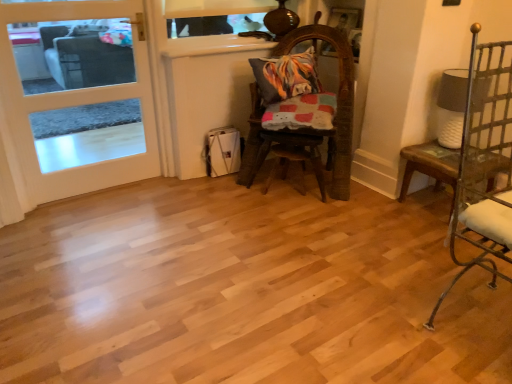
The width and height of the screenshot is (512, 384). Describe the element at coordinates (430, 165) in the screenshot. I see `white ceramic table at right` at that location.

What is the approximate height of worn wood chair at center, marked as the 1th chair in a back-to-front arrangement?

It is 3.36 feet.

Identify the location of white textured lampshade at right. pos(451,107).

At what (x,y) coordinates should I click in order to perform the action: click on white ceramic table at right. Please return your answer as a coordinate pair (x, y). The height and width of the screenshot is (384, 512). Looking at the image, I should click on (430, 165).

Based on the photo, which is in front, multicolored fabric pillow at center or white ceramic table at right?

Positioned in front is white ceramic table at right.

From the image's perspective, is multicolored fabric pillow at center above or below white ceramic table at right?

multicolored fabric pillow at center is above white ceramic table at right.

In the scene shown: Does multicolored fabric pillow at center appear on the left side of white ceramic table at right?

Yes, multicolored fabric pillow at center is to the left of white ceramic table at right.

From a real-world perspective, is white textured lampshade at right above or below white ceramic table at right?

From a real-world perspective, white textured lampshade at right is physically above white ceramic table at right.

In terms of size, does white textured lampshade at right appear bigger or smaller than white ceramic table at right?

Considering their sizes, white textured lampshade at right takes up less space than white ceramic table at right.

Are white textured lampshade at right and white ceramic table at right beside each other?

There is a gap between white textured lampshade at right and white ceramic table at right.

There is a white ceramic table at right. At what (x,y) coordinates should I click in order to perform the action: click on lamp above it (from a real-world perspective). Please return your answer as a coordinate pair (x, y). The width and height of the screenshot is (512, 384). Looking at the image, I should click on (451, 107).

From the picture: In terms of width, does white ceramic table at right look wider or thinner when compared to white wood door at left?

white ceramic table at right is wider than white wood door at left.

Which is correct: white ceramic table at right is inside white wood door at left, or outside of it?

white ceramic table at right exists outside the volume of white wood door at left.

Is white ceramic table at right looking in the opposite direction of white wood door at left?

No.

What's the angular difference between white ceramic table at right and white wood door at left's facing directions?

The angle between the facing direction of white ceramic table at right and the facing direction of white wood door at left is 0.615 degrees.

Is white textured lampshade at right inside the boundaries of white wood door at left, or outside?

white textured lampshade at right is spatially situated outside white wood door at left.

Can you confirm if white textured lampshade at right is smaller than white wood door at left?

Yes, white textured lampshade at right is smaller than white wood door at left.

From the image's perspective, would you say white textured lampshade at right is shown under white wood door at left?

Indeed, from the image's perspective, white textured lampshade at right is shown beneath white wood door at left.

Considering the positions of points (444, 72) and (16, 108), is point (444, 72) farther from camera compared to point (16, 108)?

Yes.

From a real-world perspective, does metallic silver chair at right, the 1th chair from the front, sit lower than white wood door at left?

Correct, in the physical world, metallic silver chair at right, the 1th chair from the front, is lower than white wood door at left.

Is metallic silver chair at right, positioned as the 2th chair in back-to-front order, far from white wood door at left?

Yes.

Can you tell me how much metallic silver chair at right, positioned as the first chair in right-to-left order, and white wood door at left differ in facing direction?

They differ by 93.7 degrees in their facing directions.

Measure the distance from metallic silver chair at right, the 2th chair viewed from the left, to white wood door at left.

They are 1.89 meters apart.

Considering the relative sizes of white ceramic table at right and white textured lampshade at right in the image provided, is white ceramic table at right wider than white textured lampshade at right?

Indeed, white ceramic table at right has a greater width compared to white textured lampshade at right.

Considering the relative sizes of white ceramic table at right and white textured lampshade at right in the image provided, is white ceramic table at right smaller than white textured lampshade at right?

No, white ceramic table at right is not smaller than white textured lampshade at right.

Consider the image. Visually, is white ceramic table at right positioned to the left or to the right of white textured lampshade at right?

Based on their positions, white ceramic table at right is located to the left of white textured lampshade at right.

Is white ceramic table at right aimed at white textured lampshade at right?

No, white ceramic table at right is not turned towards white textured lampshade at right.

Measure the distance between worn wood chair at center, arranged as the first chair when viewed from the left, and metallic silver chair at right, the 1th chair from the front.

worn wood chair at center, arranged as the first chair when viewed from the left, is 35.99 inches from metallic silver chair at right, the 1th chair from the front.

Who is bigger, worn wood chair at center, the second chair in the front-to-back sequence, or metallic silver chair at right, positioned as the 2th chair in back-to-front order?

worn wood chair at center, the second chair in the front-to-back sequence, is bigger.

Can you tell me how much worn wood chair at center, the second chair in the front-to-back sequence, and metallic silver chair at right, positioned as the first chair in right-to-left order, differ in facing direction?

The facing directions of worn wood chair at center, the second chair in the front-to-back sequence, and metallic silver chair at right, positioned as the first chair in right-to-left order, are 84.8 degrees apart.

Is worn wood chair at center, which is the second chair from right to left, oriented towards metallic silver chair at right, positioned as the first chair in right-to-left order?

Yes, worn wood chair at center, which is the second chair from right to left, is facing metallic silver chair at right, positioned as the first chair in right-to-left order.

You are a GUI agent. You are given a task and a screenshot of the screen. Output one action in this format:
    pyautogui.click(x=<x>, y=<y>)
    Task: Click on the pillow lying above the white ceramic table at right (from the image's perspective)
    
    Given the screenshot: What is the action you would take?
    pyautogui.click(x=286, y=76)

This screenshot has width=512, height=384. I want to click on table in front of the white textured lampshade at right, so click(430, 165).

When comparing their distances from worn wood chair at center, the second chair in the front-to-back sequence, does multicolored fabric pillow at center or white ceramic table at right seem closer?

multicolored fabric pillow at center.

When comparing their distances from white wood door at left, does white ceramic table at right or metallic silver chair at right, positioned as the 2th chair in back-to-front order, seem further?

The object further to white wood door at left is metallic silver chair at right, positioned as the 2th chair in back-to-front order.

Which object lies nearer to the anchor point worn wood chair at center, which is the second chair from right to left, white ceramic table at right or white textured lampshade at right?

white ceramic table at right lies closer to worn wood chair at center, which is the second chair from right to left, than the other object.

Based on their spatial positions, is multicolored fabric pillow at center or white ceramic table at right closer to white textured lampshade at right?

white ceramic table at right lies closer to white textured lampshade at right than the other object.

Looking at the image, which one is located further to white textured lampshade at right, white wood door at left or white ceramic table at right?

white wood door at left.

From the image, which object appears to be farther from white ceramic table at right, white textured lampshade at right or multicolored fabric pillow at center?

multicolored fabric pillow at center.

From the image, which object appears to be farther from white ceramic table at right, worn wood chair at center, the second chair in the front-to-back sequence, or multicolored fabric pillow at center?

multicolored fabric pillow at center lies further to white ceramic table at right than the other object.

Based on their spatial positions, is metallic silver chair at right, the 1th chair from the front, or white ceramic table at right closer to worn wood chair at center, arranged as the first chair when viewed from the left?

white ceramic table at right is closer to worn wood chair at center, arranged as the first chair when viewed from the left.

Where is `pillow between white wood door at left and white ceramic table at right from left to right`? pillow between white wood door at left and white ceramic table at right from left to right is located at coordinates (286, 76).

Find the location of a particular element. The width and height of the screenshot is (512, 384). chair between metallic silver chair at right, the 1th chair from the front, and white ceramic table at right from front to back is located at coordinates (310, 128).

I want to click on pillow between white wood door at left and metallic silver chair at right, the 1th chair from the front, so click(x=286, y=76).

Where is `pillow located between white wood door at left and worn wood chair at center, arranged as the first chair when viewed from the left, in the left-right direction`? pillow located between white wood door at left and worn wood chair at center, arranged as the first chair when viewed from the left, in the left-right direction is located at coordinates (286, 76).